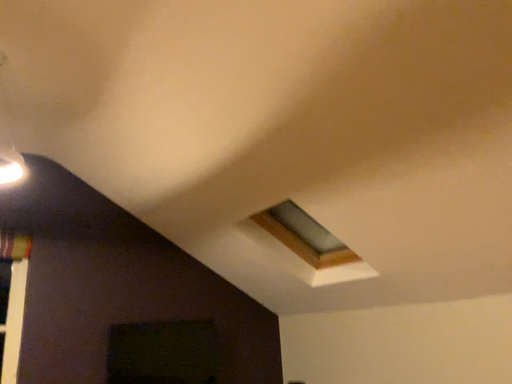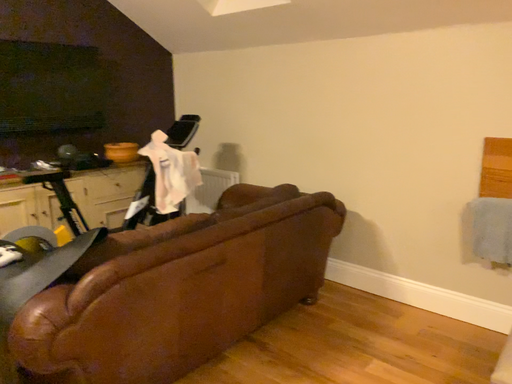
Question: How did the camera likely rotate when shooting the video?

Choices:
 (A) rotated right
 (B) rotated left

Answer: (A)